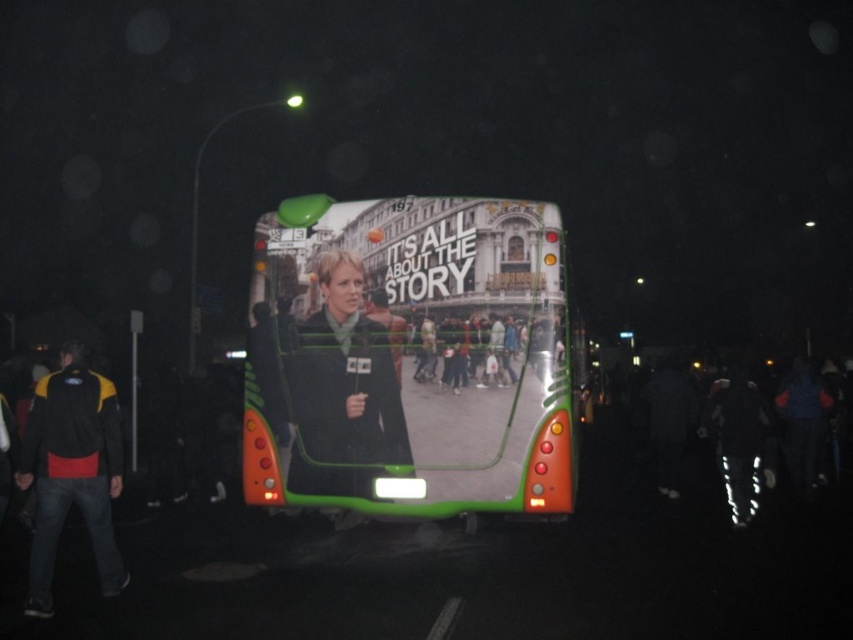
You are a pedestrian standing on the sidewalk. You see the green matte bus at center and the matte black jacket at center. Which object is closer to you?

The green matte bus at center is closer to you because it is in front of the matte black jacket at center.

You are standing at the origin point in the image. You need to walk to the green matte bus at center. Which direction should you walk? Please answer with a direction like north, south, east, west, or a combination like northeast.

The green matte bus at center is located at point (x=410, y=358). Since the coordinate system likely places the origin at the bottom left corner, the bus is to the northeast of your current position. You should walk northeast.